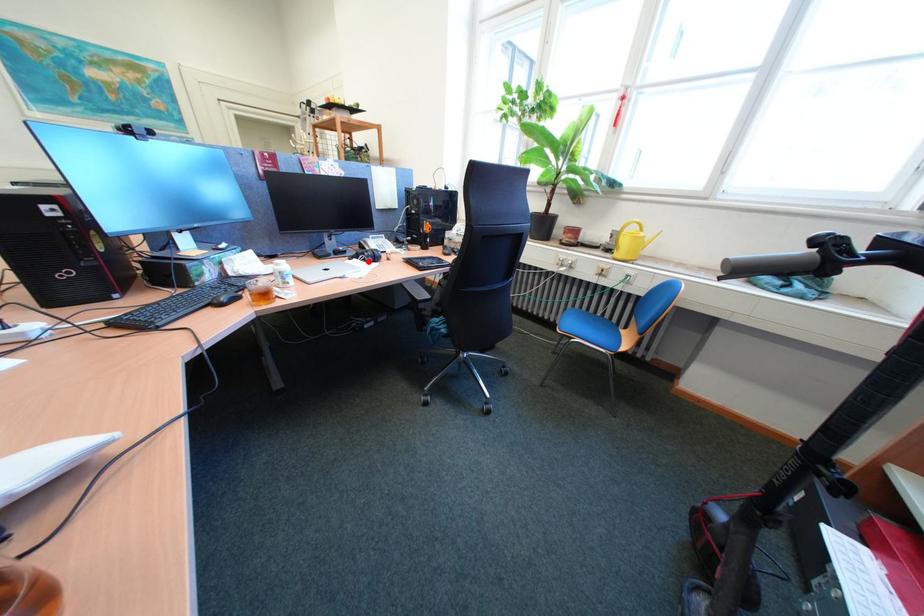
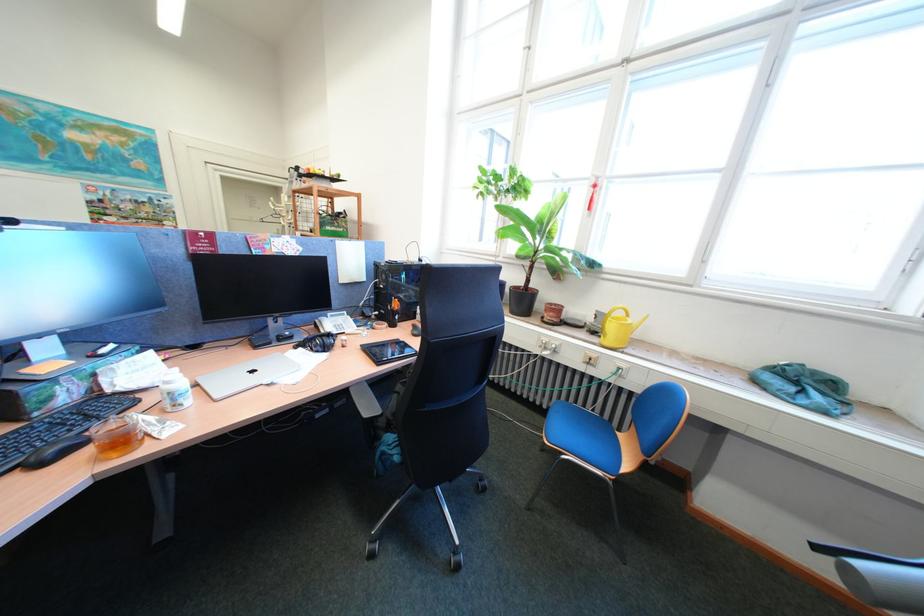
Find the pixel in the second image that matches the highlighted location in the first image.

(313, 351)